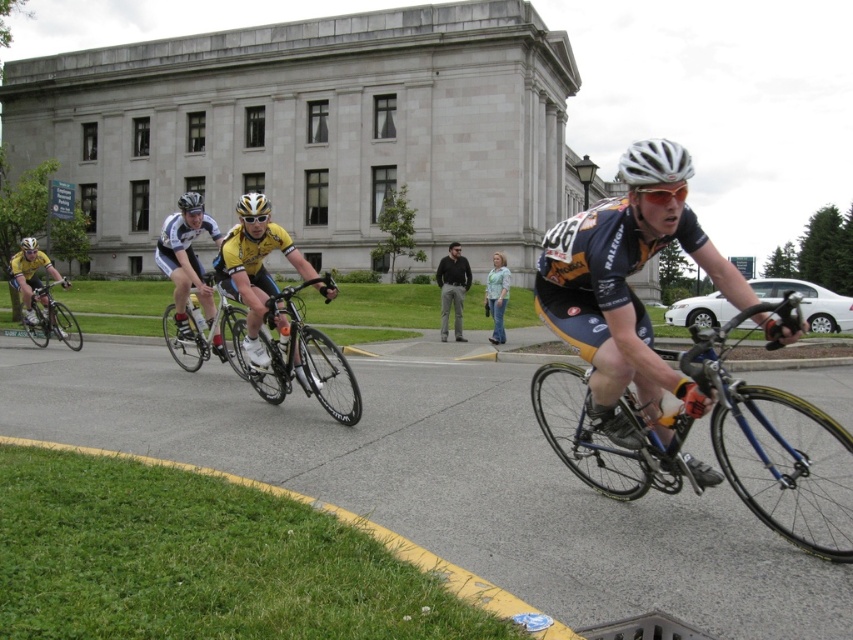
You are a photographer positioned at the back of the cycling race. You notice the yellow jersey cyclist at center and the gold reflective helmet at center in your camera frame. Which object appears smaller in the viewfinder?

The yellow jersey cyclist at center appears smaller than the gold reflective helmet at center in the viewfinder.

You are standing at the starting line of the cycling race. There is a point marked at coordinates point (x=271, y=282). If you want to place a starting flag exactly 10 meters away from where you are standing, will the flag be placed beyond this point?

The point (x=271, y=282) is 8.60 meters away from the viewer. Since the flag needs to be placed 10 meters away, it will be placed beyond this point.

You are a photographer positioned at the starting line of the cycling race. You want to capture a photo where the blue jersey at center and the shiny black bicycle at center are both clearly visible. Based on their positions, which object should you focus on first to ensure both are in the frame?

The blue jersey at center is located below the shiny black bicycle at center. To ensure both are in the frame, focus on the shiny black bicycle at center first as it is above the blue jersey at center, allowing the camera to capture both objects in the vertical composition.